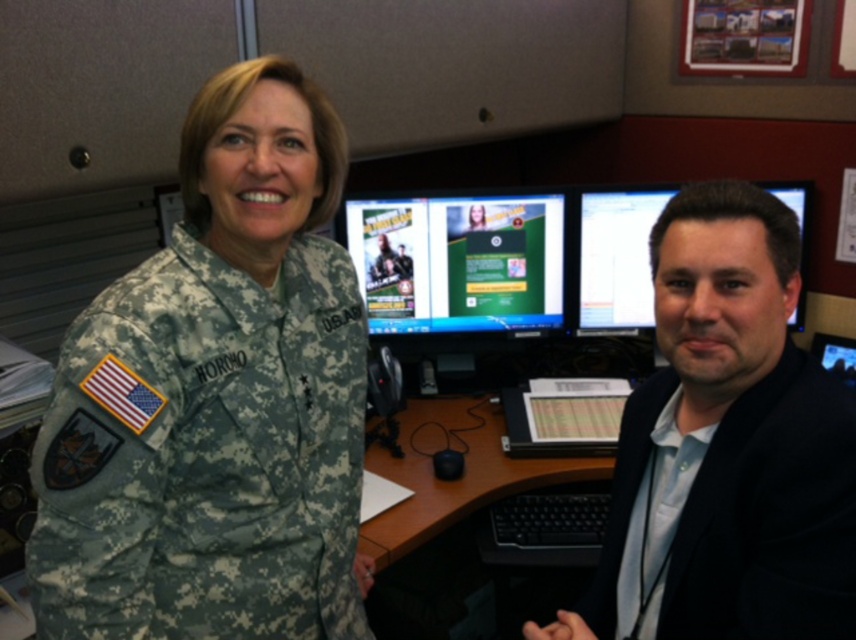
Question: Is camouflage uniform at center smaller than black smooth suit at right?

Choices:
 (A) yes
 (B) no

Answer: (A)

Question: Does green matte screen at center appear on the right side of matte black monitor at right?

Choices:
 (A) yes
 (B) no

Answer: (B)

Question: Which object is farther from the camera taking this photo?

Choices:
 (A) green matte screen at center
 (B) matte black monitor at right
 (C) camouflage uniform at center
 (D) black smooth suit at right

Answer: (B)

Question: Which of the following is the closest to the observer?

Choices:
 (A) matte black monitor at right
 (B) camouflage uniform at center

Answer: (B)

Question: Is camouflage uniform at center above matte black monitor at right?

Choices:
 (A) no
 (B) yes

Answer: (A)

Question: Which is nearer to the matte black monitor at right?

Choices:
 (A) green matte screen at center
 (B) camouflage uniform at center

Answer: (A)